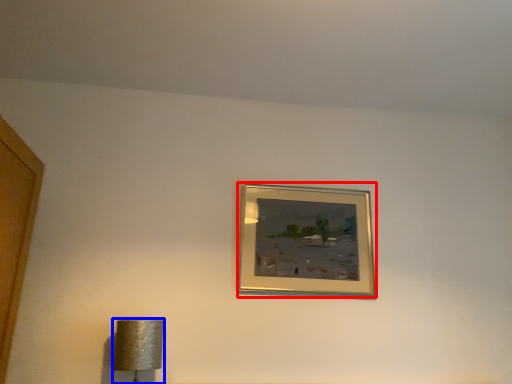
Question: Which object is further to the camera taking this photo, picture frame (highlighted by a red box) or lamp (highlighted by a blue box)?

Choices:
 (A) picture frame
 (B) lamp

Answer: (A)